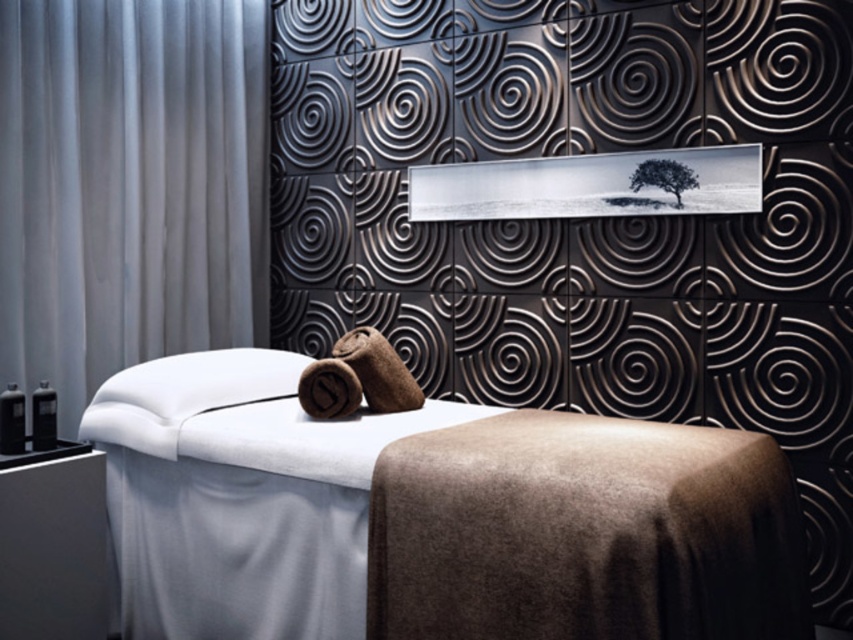
You are a guest entering the spa room and want to lie on the white fabric bed at center. Before doing so, you notice a white fabric curtain at left near the entrance. Which object is wider in the image?

The white fabric bed at center is wider than the white fabric curtain at left according to the description.

You are a client entering the spa room and want to find the massage table. According to the coordinates provided, where exactly is the white fabric bed at center located?

The white fabric bed at center is located at point [432,516].